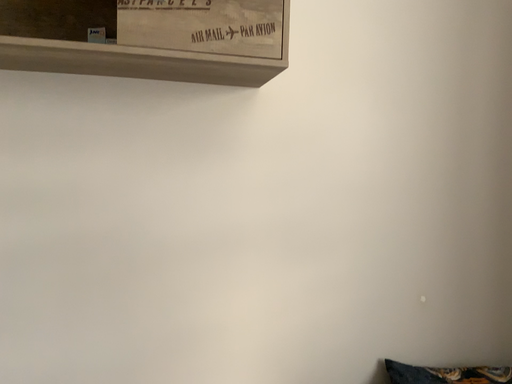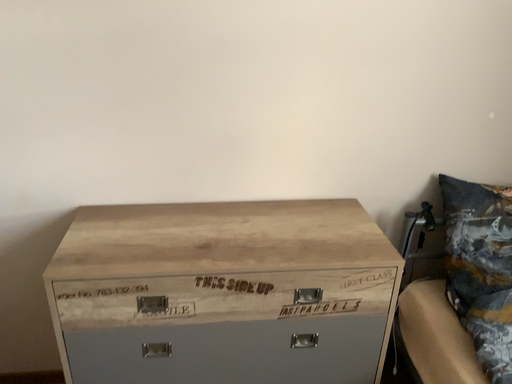
Question: Which way did the camera rotate in the video?

Choices:
 (A) rotated downward
 (B) rotated upward

Answer: (A)